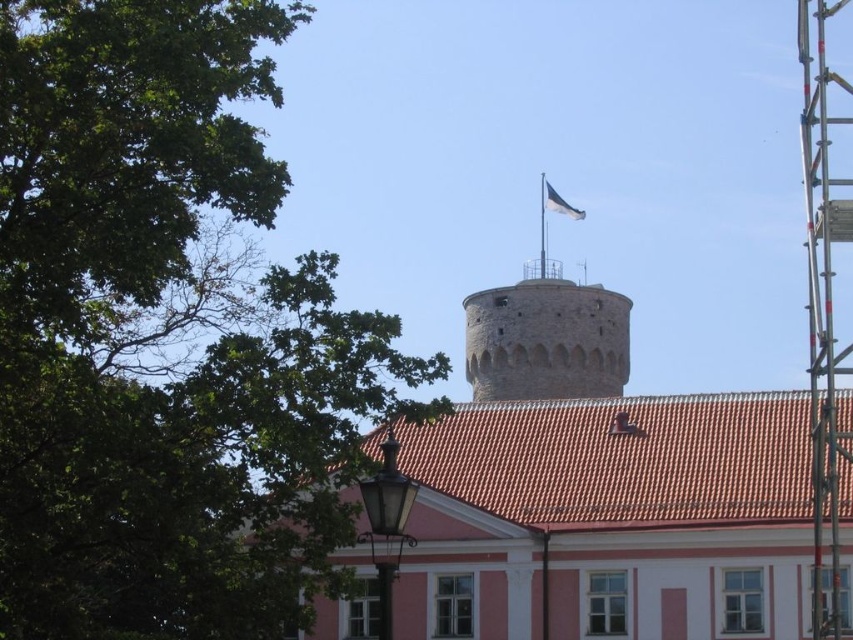
Who is taller, green leafy tree at upper left or white fabric flag at upper center?

green leafy tree at upper left is taller.

Between green leafy tree at upper left and white fabric flag at upper center, which one appears on the right side from the viewer's perspective?

Positioned to the right is white fabric flag at upper center.

You are a GUI agent. You are given a task and a screenshot of the screen. Output one action in this format:
    pyautogui.click(x=<x>, y=<y>)
    Task: Click on the green leafy tree at upper left
    
    Given the screenshot: What is the action you would take?
    coord(166,337)

Who is positioned more to the right, green leafy tree at upper left or metallic ladder at upper right?

metallic ladder at upper right

Identify the location of green leafy tree at upper left. (166, 337).

Does point (67, 561) lie behind point (842, 353)?

No, it is not.

Locate an element on the screen. Image resolution: width=853 pixels, height=640 pixels. green leafy tree at upper left is located at coordinates (166, 337).

Which is more to the left, brown stone tower at center or white fabric flag at upper center?

brown stone tower at center

Looking at this image, between brown stone tower at center and white fabric flag at upper center, which one appears on the right side from the viewer's perspective?

white fabric flag at upper center

Who is more distant from viewer, (577, 312) or (556, 202)?

Positioned behind is point (556, 202).

Find the location of a particular element. The image size is (853, 640). brown stone tower at center is located at coordinates (544, 339).